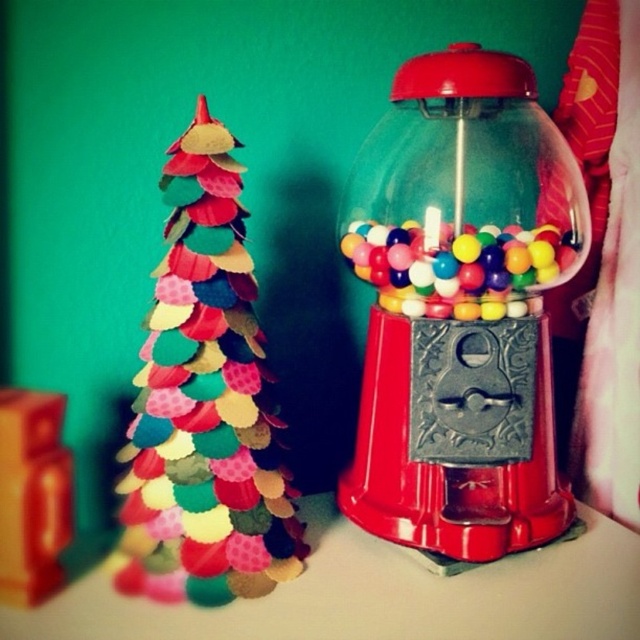
Question: Does multicolored felt christmas tree at left have a smaller size compared to matte cardboard box at lower left?

Choices:
 (A) yes
 (B) no

Answer: (B)

Question: Is the position of shiny plastic gumball machine at right more distant than that of shiny plastic gumballs at center?

Choices:
 (A) no
 (B) yes

Answer: (A)

Question: Which point is farther to the camera?

Choices:
 (A) (225, 456)
 (B) (497, 244)

Answer: (B)

Question: Can you confirm if multicolored felt christmas tree at left is thinner than shiny plastic gumballs at center?

Choices:
 (A) no
 (B) yes

Answer: (B)

Question: Which of the following is the farthest from the observer?

Choices:
 (A) shiny plastic gumball machine at right
 (B) matte cardboard box at lower left
 (C) shiny plastic gumballs at center
 (D) multicolored felt christmas tree at left

Answer: (C)

Question: Which point appears closest to the camera in this image?

Choices:
 (A) (422, 237)
 (B) (381, 292)

Answer: (A)